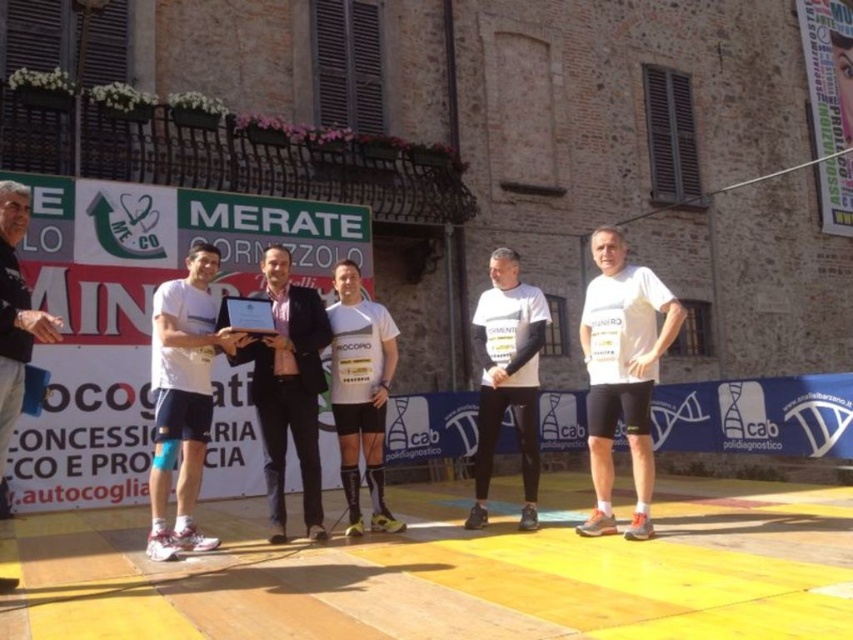
You are organizing a photo shoot and need to place a large prop between the matte black suit at center and the dark gray sweater at left. Considering their sizes, which object should the prop be placed closer to?

The matte black suit at center is bigger than the dark gray sweater at left, so the large prop should be placed closer to the matte black suit at center to maintain balance.

Based on the photo, you are standing at the point with coordinates point [288,388]. What object is located at that point?

The point [288,388] corresponds to the matte black suit at center.